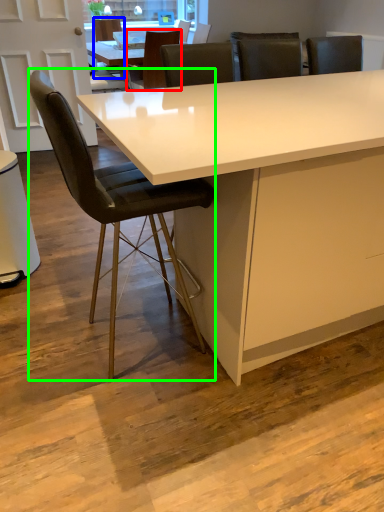
Question: Which is farther away from chair (highlighted by a red box)? chair (highlighted by a blue box) or chair (highlighted by a green box)?

Choices:
 (A) chair
 (B) chair

Answer: (B)